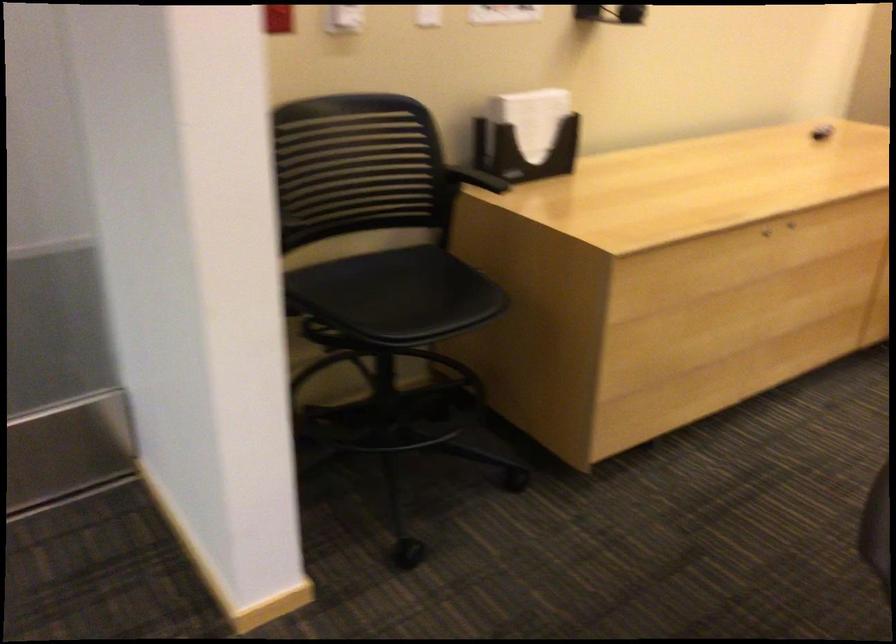
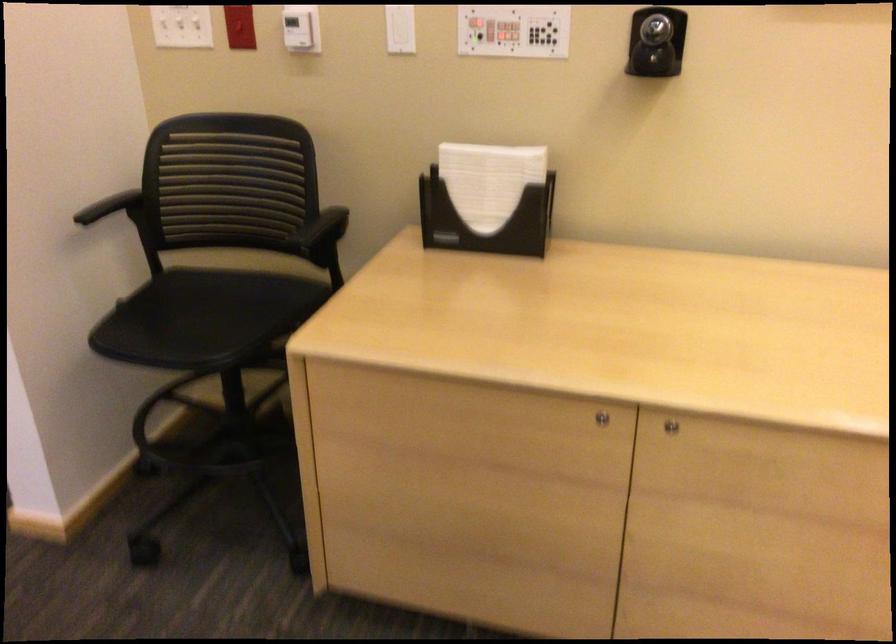
The point at (754,250) is marked in the first image. Where is the corresponding point in the second image?

(600, 418)